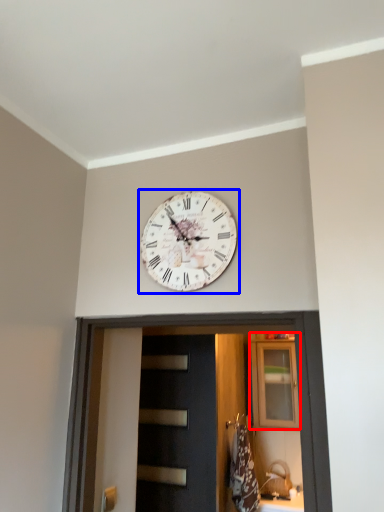
Question: Which of the following is the closest to the observer, cabinetry (highlighted by a red box) or wall clock (highlighted by a blue box)?

Choices:
 (A) cabinetry
 (B) wall clock

Answer: (B)